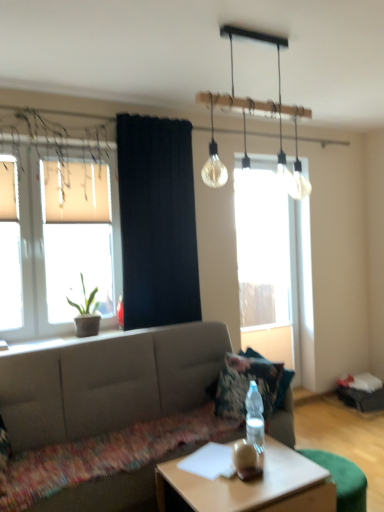
Question: From a real-world perspective, is translucent glass window at left, the 1th window when ordered from front to back, located higher than green matte plant at left?

Choices:
 (A) yes
 (B) no

Answer: (A)

Question: Does translucent glass window at left, the first window viewed from the left, have a smaller size compared to green matte plant at left?

Choices:
 (A) no
 (B) yes

Answer: (A)

Question: From the image's perspective, is translucent glass window at left, which ranks as the second window in back-to-front order, located above green matte plant at left?

Choices:
 (A) no
 (B) yes

Answer: (B)

Question: Is translucent glass window at left, the 1th window when ordered from front to back, positioned behind green matte plant at left?

Choices:
 (A) no
 (B) yes

Answer: (A)

Question: Considering the relative sizes of translucent glass window at left, which ranks as the second window in back-to-front order, and green matte plant at left in the image provided, is translucent glass window at left, which ranks as the second window in back-to-front order, shorter than green matte plant at left?

Choices:
 (A) no
 (B) yes

Answer: (A)

Question: Are translucent glass window at left, the 1th window when ordered from front to back, and green matte plant at left located far from each other?

Choices:
 (A) no
 (B) yes

Answer: (A)

Question: Does matte gray couch at center have a smaller size compared to black fabric curtain at center?

Choices:
 (A) yes
 (B) no

Answer: (B)

Question: Is matte gray couch at center shorter than black fabric curtain at center?

Choices:
 (A) no
 (B) yes

Answer: (B)

Question: Is matte gray couch at center closer to the viewer compared to black fabric curtain at center?

Choices:
 (A) no
 (B) yes

Answer: (B)

Question: Does matte gray couch at center have a larger size compared to black fabric curtain at center?

Choices:
 (A) no
 (B) yes

Answer: (B)

Question: Is matte gray couch at center taller than black fabric curtain at center?

Choices:
 (A) no
 (B) yes

Answer: (A)

Question: Does matte gray couch at center lie behind black fabric curtain at center?

Choices:
 (A) no
 (B) yes

Answer: (A)

Question: Does green matte plant at left appear on the left side of translucent glass light fixture at upper center?

Choices:
 (A) no
 (B) yes

Answer: (B)